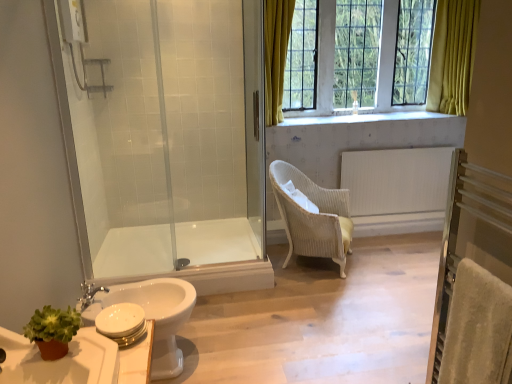
Identify the location of translucent glass vase at upper center. (354, 102).

The width and height of the screenshot is (512, 384). What do you see at coordinates (354, 102) in the screenshot? I see `translucent glass vase at upper center` at bounding box center [354, 102].

This screenshot has height=384, width=512. What do you see at coordinates (155, 316) in the screenshot?
I see `white glossy toilet at lower left` at bounding box center [155, 316].

Locate an element on the screen. The image size is (512, 384). beige wicker chair at center is located at coordinates (313, 217).

Who is bigger, white glossy bathtub at center or white matte toilet paper at lower left?

white glossy bathtub at center.

Considering the sizes of objects white glossy bathtub at center and white matte toilet paper at lower left in the image provided, who is taller, white glossy bathtub at center or white matte toilet paper at lower left?

Standing taller between the two is white glossy bathtub at center.

Does point (136, 230) come closer to viewer compared to point (122, 311)?

That is False.

Identify the location of toilet paper in front of the white glossy bathtub at center. The image size is (512, 384). (120, 320).

Considering their positions, is clear glass shower door at center located in front of or behind beige velvety towel at lower right?

clear glass shower door at center is behind beige velvety towel at lower right.

Is clear glass shower door at center at the left side of beige velvety towel at lower right?

Correct, you'll find clear glass shower door at center to the left of beige velvety towel at lower right.

Considering the sizes of objects clear glass shower door at center and beige velvety towel at lower right in the image provided, who is bigger, clear glass shower door at center or beige velvety towel at lower right?

clear glass shower door at center.

From the image's perspective, who appears lower, clear glass shower door at center or beige velvety towel at lower right?

beige velvety towel at lower right, from the image's perspective.

Is clear glass shower door at center surrounding white glossy sink at lower left?

No, white glossy sink at lower left is not surrounded by clear glass shower door at center.

Is clear glass shower door at center beside white glossy sink at lower left?

clear glass shower door at center and white glossy sink at lower left are not in contact.

Which point is more forward, (x=262, y=25) or (x=6, y=370)?

The point (x=6, y=370) is more forward.

Is clear glass shower door at center behind white glossy sink at lower left?

That is True.

From a real-world perspective, which object stands above the other?

clear glass shower door at center.

Does point (67, 317) lie in front of point (246, 134)?

Yes, point (67, 317) is in front of point (246, 134).

Choose the correct answer: Is green matte plant at lower left inside clear glass shower door at center or outside it?

green matte plant at lower left is spatially situated outside clear glass shower door at center.

From the image's perspective, who appears lower, green matte plant at lower left or clear glass shower door at center?

From the image's view, green matte plant at lower left is below.

Which object is closer to the camera, white glossy toilet at lower left or green matte plant at lower left?

Positioned in front is green matte plant at lower left.

Considering the positions of objects white glossy toilet at lower left and green matte plant at lower left in the image provided, who is more to the left, white glossy toilet at lower left or green matte plant at lower left?

white glossy toilet at lower left is more to the left.

Is green matte plant at lower left at the back of white glossy toilet at lower left?

white glossy toilet at lower left does not have its back to green matte plant at lower left.

Is white textured radiator at center right positioned with its back to beige velvety towel at lower right?

No.

Between white textured radiator at center right and beige velvety towel at lower right, which one has more height?

white textured radiator at center right.

From the image's perspective, relative to beige velvety towel at lower right, is white textured radiator at center right above or below?

Based on their image positions, white textured radiator at center right is located above beige velvety towel at lower right.

Which is correct: white textured radiator at center right is inside beige velvety towel at lower right, or outside of it?

The correct answer is: outside.

Considering the sizes of objects green matte plant at lower left and white glossy bathtub at center in the image provided, who is shorter, green matte plant at lower left or white glossy bathtub at center?

green matte plant at lower left is shorter.

Considering the relative positions of green matte plant at lower left and white glossy bathtub at center in the image provided, is green matte plant at lower left to the left of white glossy bathtub at center from the viewer's perspective?

No.

Is green matte plant at lower left beside white glossy bathtub at center?

There is a gap between green matte plant at lower left and white glossy bathtub at center.

What are the coordinates of `bathtub below the white matte toilet paper at lower left (from the image's perspective)` in the screenshot? It's located at (186, 256).

I want to click on towel that appears on the right of clear glass shower door at center, so click(477, 329).

Based on their spatial positions, is translucent glass vase at upper center or white textured radiator at center right further from white matte toilet paper at lower left?

Based on the image, translucent glass vase at upper center appears to be further to white matte toilet paper at lower left.

When comparing their distances from silver metallic faucet at lower left, does transparent glass shower door at left or white glossy sink at lower left seem closer?

white glossy sink at lower left is positioned closer to the anchor silver metallic faucet at lower left.

Looking at the image, which one is located closer to white textured radiator at center right, beige velvety towel at lower right or white glossy sink at lower left?

Based on the image, beige velvety towel at lower right appears to be nearer to white textured radiator at center right.

Considering their positions, is translucent glass vase at upper center positioned further to white glossy bathtub at center than white matte toilet paper at lower left?

translucent glass vase at upper center is positioned further to the anchor white glossy bathtub at center.

Estimate the real-world distances between objects in this image. Which object is closer to white glossy sink at lower left, white glossy toilet at lower left or beige velvety towel at lower right?

white glossy toilet at lower left lies closer to white glossy sink at lower left than the other object.

Looking at the image, which one is located further to silver metallic faucet at lower left, white glossy sink at lower left or beige velvety towel at lower right?

beige velvety towel at lower right is positioned further to the anchor silver metallic faucet at lower left.

Considering their positions, is clear glass shower door at center positioned further to white textured radiator at center right than transparent glass shower door at left?

transparent glass shower door at left is further to white textured radiator at center right.

Based on their spatial positions, is green matte plant at lower left or transparent glass shower door at left further from white glossy bathtub at center?

green matte plant at lower left is further to white glossy bathtub at center.

Where is `screen door located between white glossy bathtub at center and translucent glass vase at upper center in the left-right direction`? The image size is (512, 384). screen door located between white glossy bathtub at center and translucent glass vase at upper center in the left-right direction is located at coordinates (255, 118).

Find the location of a particular element. bathtub between silver metallic faucet at lower left and white textured radiator at center right in the horizontal direction is located at coordinates (186, 256).

I want to click on screen door between silver metallic faucet at lower left and clear glass window at upper center from left to right, so click(x=255, y=118).

This screenshot has width=512, height=384. Find the location of `toilet paper between white glossy sink at lower left and translucent glass vase at upper center along the z-axis`. toilet paper between white glossy sink at lower left and translucent glass vase at upper center along the z-axis is located at coordinates (120, 320).